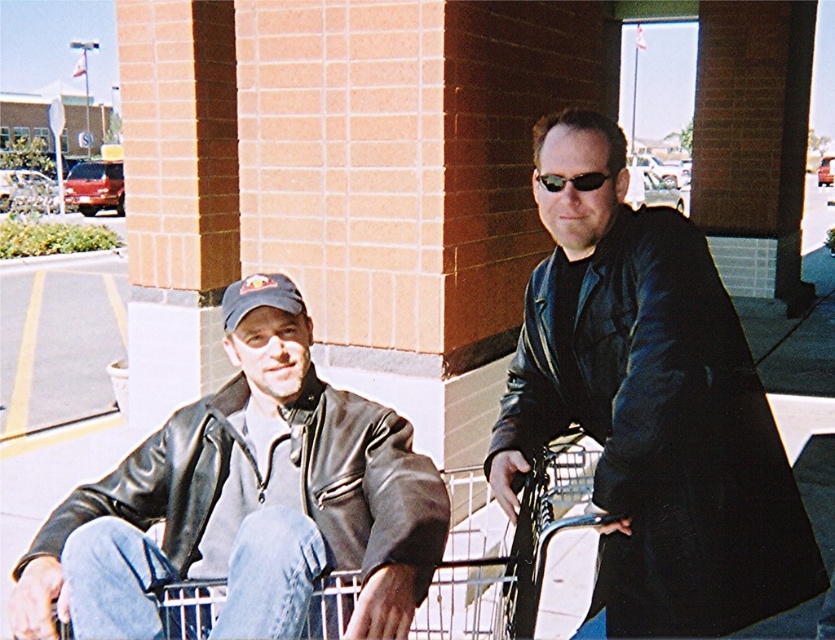
You are standing at the camera position in the parking lot scene. There is a point at coordinates point (505, 588). Can you reach this point without moving more than 6.40 feet forward?

The distance of point (505, 588) from camera is 6.40 feet, so yes, you can reach this point by moving exactly 6.40 feet forward from your current position.

You are a delivery robot with a width of 1 meter. You need to move from your current position to the building entrance located near the white column. There is a metallic silver shopping cart at lower center and a black plastic sunglasses at upper center in your path. Can you pass through the gap between them without touching either?

The distance between the metallic silver shopping cart at lower center and the black plastic sunglasses at upper center is 1.31 meters. Since the robot is 1 meter wide, there is enough space to pass through the gap without touching either object.

You are a drone operator trying to deliver a package to one of two points in the image. The first point is at coordinates point (701, 438) and the second is at point (287, 296). Which point is closer to you, the drone operator, based on the image perspective?

Point (701, 438) is closer to the viewer than point (287, 296), so the drone operator should deliver the package to point (701, 438) first as it is nearer.